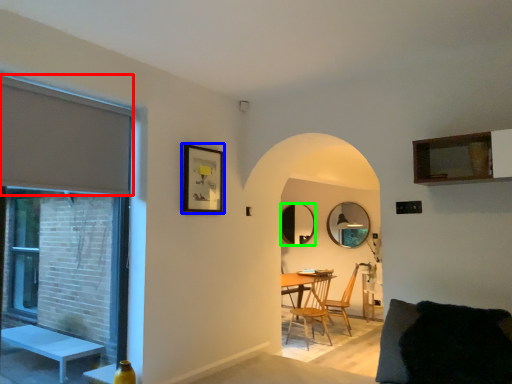
Question: Which object is the closest to the curtain (highlighted by a red box)? Choose among these: picture frame (highlighted by a blue box) or mirror (highlighted by a green box).

Choices:
 (A) picture frame
 (B) mirror

Answer: (A)